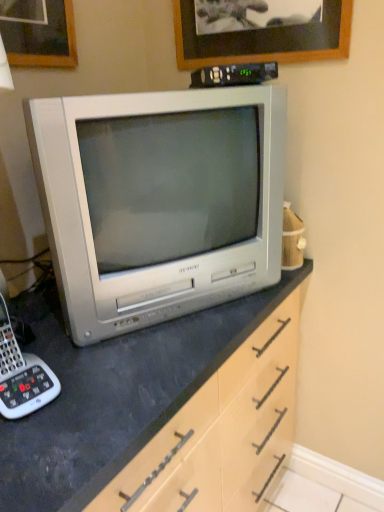
Question: From the image's perspective, is silver metallic television at center above white plastic corded phone at lower left?

Choices:
 (A) yes
 (B) no

Answer: (A)

Question: Is silver metallic television at center taller than white plastic corded phone at lower left?

Choices:
 (A) no
 (B) yes

Answer: (B)

Question: From a real-world perspective, does silver metallic television at center stand above white plastic corded phone at lower left?

Choices:
 (A) no
 (B) yes

Answer: (B)

Question: Is the depth of silver metallic television at center greater than that of white plastic corded phone at lower left?

Choices:
 (A) yes
 (B) no

Answer: (A)

Question: Is silver metallic television at center completely or partially outside of white plastic corded phone at lower left?

Choices:
 (A) no
 (B) yes

Answer: (B)

Question: Is silver metallic television at center oriented towards white plastic corded phone at lower left?

Choices:
 (A) yes
 (B) no

Answer: (B)

Question: Would you say wooden picture frame at upper center is outside white plastic corded phone at lower left?

Choices:
 (A) no
 (B) yes

Answer: (B)

Question: Are wooden picture frame at upper center and white plastic corded phone at lower left located far from each other?

Choices:
 (A) yes
 (B) no

Answer: (B)

Question: Does wooden picture frame at upper center have a lesser width compared to white plastic corded phone at lower left?

Choices:
 (A) yes
 (B) no

Answer: (A)

Question: Is wooden picture frame at upper center turned away from white plastic corded phone at lower left?

Choices:
 (A) yes
 (B) no

Answer: (B)

Question: Considering the relative positions of wooden picture frame at upper center and white plastic corded phone at lower left in the image provided, is wooden picture frame at upper center to the right of white plastic corded phone at lower left from the viewer's perspective?

Choices:
 (A) yes
 (B) no

Answer: (A)

Question: Considering the relative sizes of wooden picture frame at upper center and white plastic corded phone at lower left in the image provided, is wooden picture frame at upper center wider than white plastic corded phone at lower left?

Choices:
 (A) no
 (B) yes

Answer: (A)

Question: Does black plastic remote control at upper center have a lesser width compared to wooden picture frame at upper center?

Choices:
 (A) no
 (B) yes

Answer: (B)